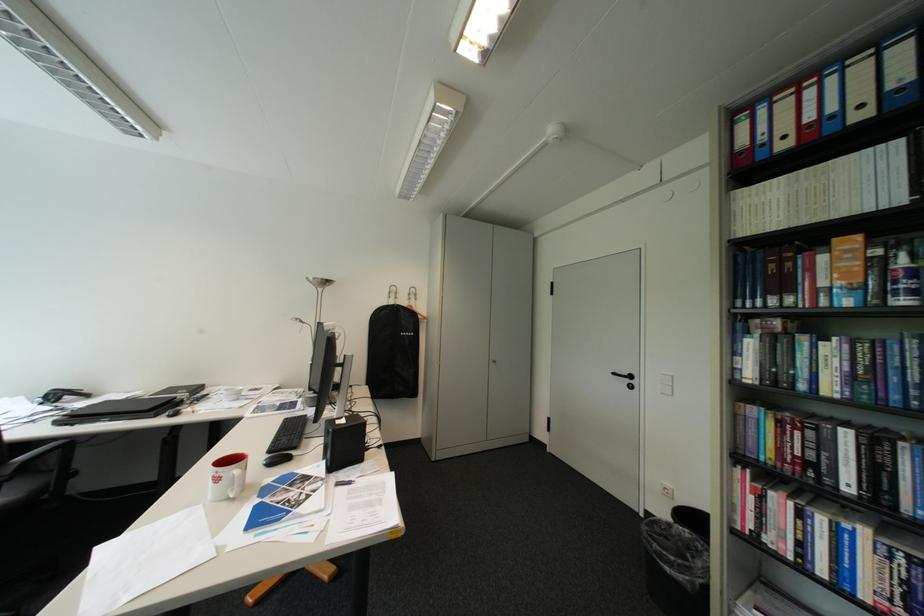
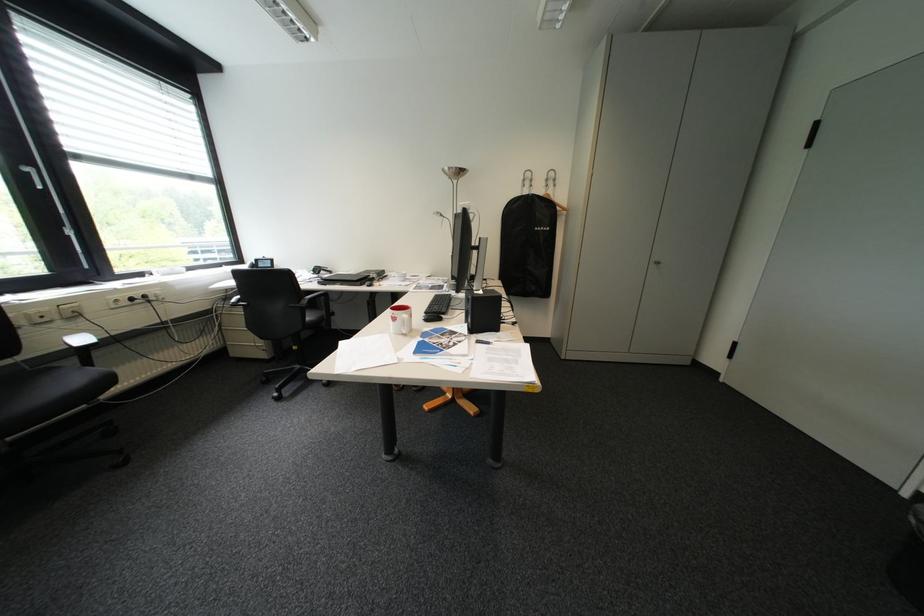
Where in the second image is the point corresponding to point (258, 467) from the first image?

(423, 315)